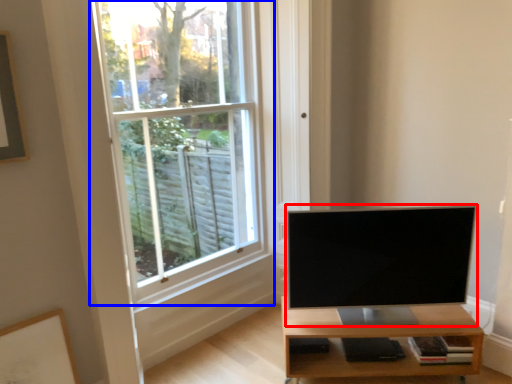
Question: Among these objects, which one is nearest to the camera, television (highlighted by a red box) or window (highlighted by a blue box)?

Choices:
 (A) television
 (B) window

Answer: (B)